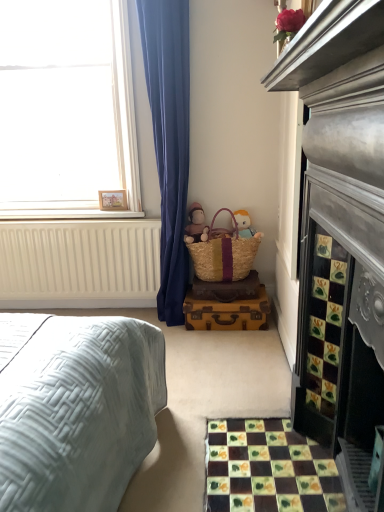
Question: Is woven straw picnic basket at lower center spatially inside white painted wood at upper left, or outside of it?

Choices:
 (A) inside
 (B) outside

Answer: (B)

Question: From their relative heights in the image, would you say woven straw picnic basket at lower center is taller or shorter than white painted wood at upper left?

Choices:
 (A) short
 (B) tall

Answer: (B)

Question: Estimate the real-world distances between objects in this image. Which object is farther from the wooden frame at upper left?

Choices:
 (A) multicolored mosaic tiles at lower right
 (B) matte pink plush at center
 (C) white painted wood at upper left
 (D) woven straw picnic basket at lower center
 (E) beige wicker basket at center

Answer: (A)

Question: Which of these objects is positioned closest to the matte pink plush at center?

Choices:
 (A) beige wicker basket at center
 (B) multicolored mosaic tiles at lower right
 (C) white matte window at upper left
 (D) woven straw picnic basket at lower center
 (E) wooden frame at upper left

Answer: (D)